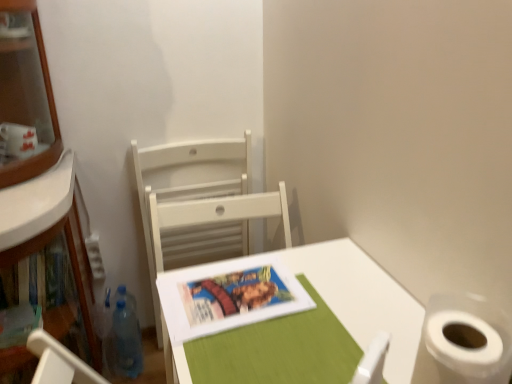
Image resolution: width=512 pixels, height=384 pixels. In order to click on free space above white matte table at center (from a real-world perspective) in this screenshot , I will do `click(287, 303)`.